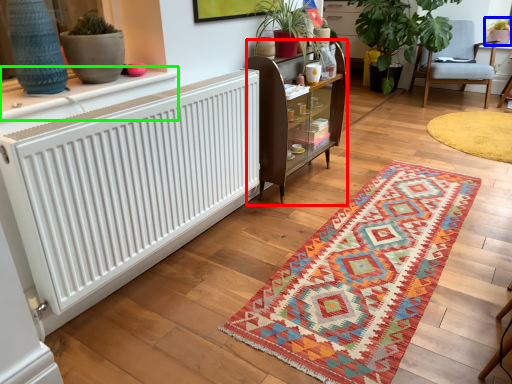
Question: Which object is the farthest from shelf (highlighted by a red box)? Choose among these: houseplant (highlighted by a blue box) or table (highlighted by a green box).

Choices:
 (A) houseplant
 (B) table

Answer: (A)